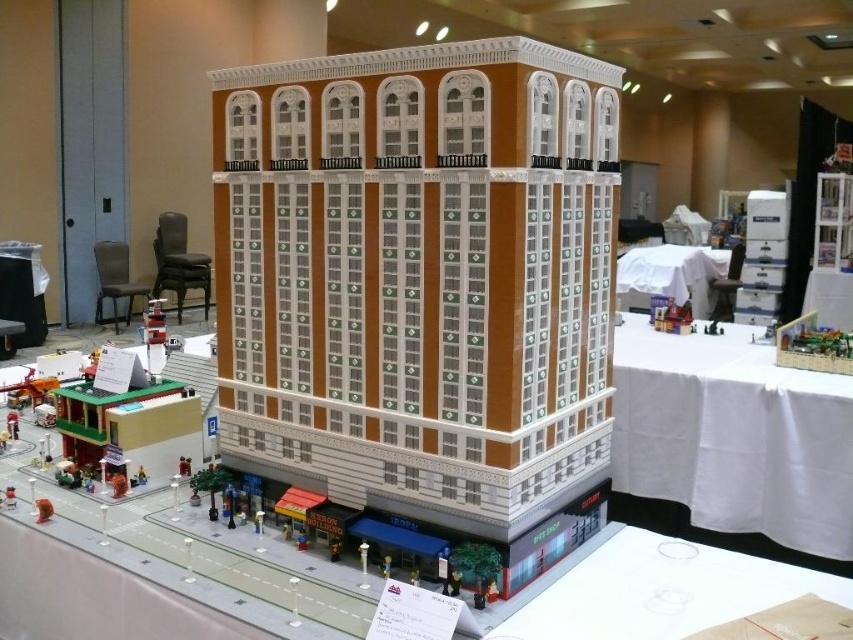
You are standing at the point marked as point (347, 392) in the Lego model. If you want to place a Lego figure that is 0.3 meters tall on the ground, will it be visible from your current position?

The point marked as point (347, 392) is 1.30 meters away from the viewer. Since the Lego figure is only 0.3 meters tall, it may not be visible from that distance unless the viewer has excellent eyesight or uses magnification. However, visibility also depends on lighting and other factors in the Lego model.

You are a Lego figure standing at the base of the multi story building in the Lego model. You want to walk towards the crosswalk on the street. Which of the two points, point (425, 116) or point (694, 246), would you reach first?

You would reach point (425, 116) first because it is closer to the viewer than point (694, 246).

You are a Lego enthusiast attending an exhibition and notice two tables with Lego models. The white glossy table at lower right has a multi story building, and the white fabric table at center has a street scene. Which table is closer to the entrance of the exhibition hall?

The white glossy table at lower right is closer to the entrance because it is in front of the white fabric table at center, indicating it is positioned nearer to the entrance.